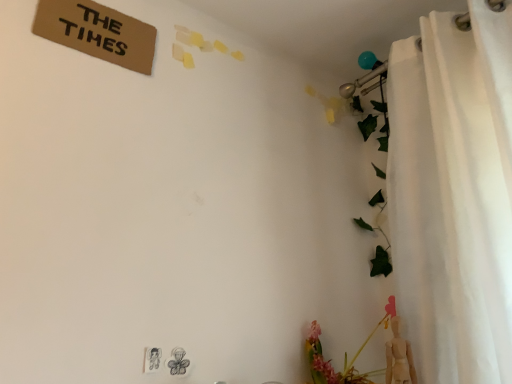
Question: Is white fabric curtain at right inside the boundaries of pink matte floral arrangement at lower right, or outside?

Choices:
 (A) inside
 (B) outside

Answer: (B)

Question: In terms of height, does white fabric curtain at right look taller or shorter compared to pink matte floral arrangement at lower right?

Choices:
 (A) short
 (B) tall

Answer: (B)

Question: Is white fabric curtain at right bigger or smaller than pink matte floral arrangement at lower right?

Choices:
 (A) small
 (B) big

Answer: (B)

Question: From their relative heights in the image, would you say pink matte floral arrangement at lower right is taller or shorter than white fabric curtain at right?

Choices:
 (A) short
 (B) tall

Answer: (A)

Question: Is pink matte floral arrangement at lower right in front of or behind white fabric curtain at right in the image?

Choices:
 (A) behind
 (B) front

Answer: (A)

Question: In the image, is pink matte floral arrangement at lower right on the left side or the right side of white fabric curtain at right?

Choices:
 (A) left
 (B) right

Answer: (A)

Question: From the image's perspective, is pink matte floral arrangement at lower right located above or below white fabric curtain at right?

Choices:
 (A) below
 (B) above

Answer: (A)